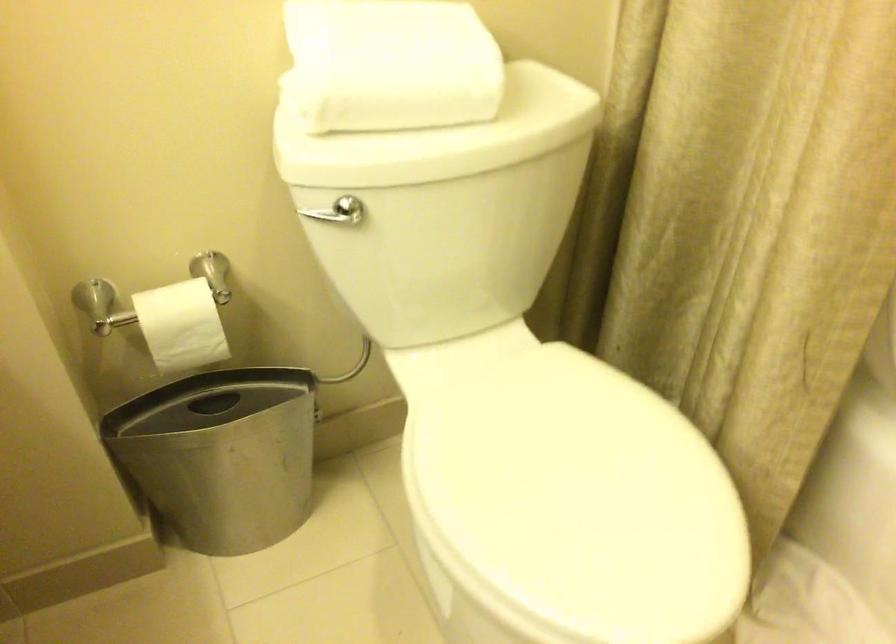
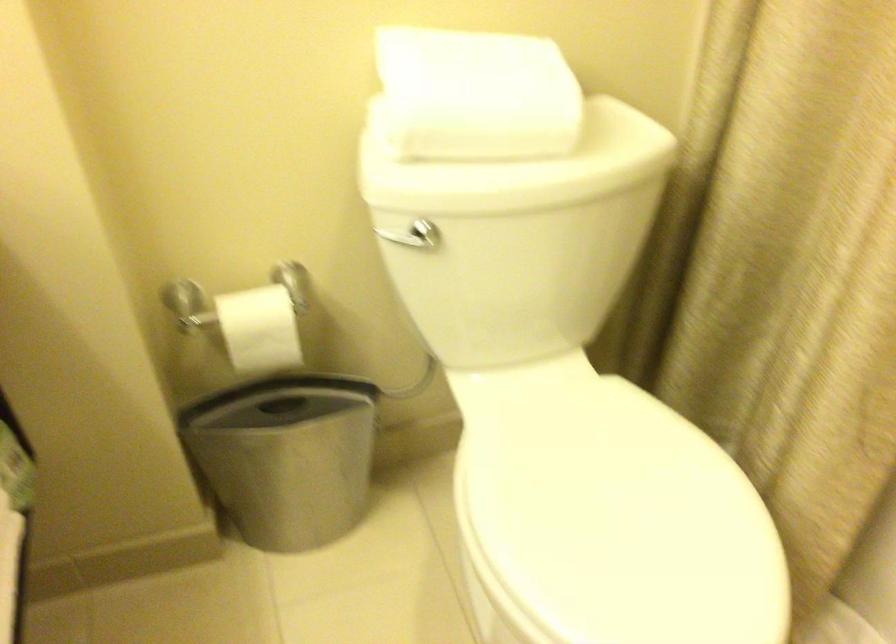
In the second image, find the point that corresponds to (222,453) in the first image.

(286, 456)